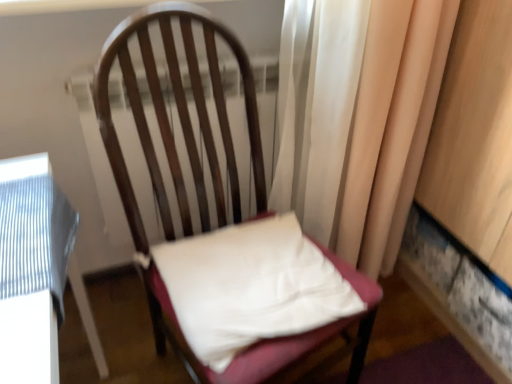
At what (x,y) coordinates should I click in order to perform the action: click on white fabric pillow at center. Please return your answer as a coordinate pair (x, y). Looking at the image, I should click on (250, 286).

Describe the element at coordinates (357, 118) in the screenshot. I see `silky beige curtain at right` at that location.

What is the approximate width of wooden chair at center?

The width of wooden chair at center is 57.24 centimeters.

This screenshot has height=384, width=512. What do you see at coordinates (179, 117) in the screenshot?
I see `wooden chair at center` at bounding box center [179, 117].

Where is `white fabric pillow at center`? This screenshot has width=512, height=384. white fabric pillow at center is located at coordinates (250, 286).

Is white fabric pillow at center taller or shorter than wooden chair at center?

In the image, white fabric pillow at center appears to be shorter than wooden chair at center.

From a real-world perspective, which object rests below the other?

In real-world perspective, white fabric pillow at center is lower.

Is white fabric pillow at center next to wooden chair at center and touching it?

No, white fabric pillow at center is not making contact with wooden chair at center.

Can you confirm if white fabric pillow at center is smaller than wooden chair at center?

Correct, white fabric pillow at center occupies less space than wooden chair at center.

Choose the correct answer: Is wooden chair at center inside silky beige curtain at right or outside it?

wooden chair at center exists outside the volume of silky beige curtain at right.

Is wooden chair at center behind silky beige curtain at right?

No, it is in front of silky beige curtain at right.

Based on the photo, how distant is wooden chair at center from silky beige curtain at right?

wooden chair at center and silky beige curtain at right are 11.75 inches apart.

Can you tell me how much wooden chair at center and silky beige curtain at right differ in facing direction?

The angle between the facing direction of wooden chair at center and the facing direction of silky beige curtain at right is 23.3 degrees.

From the picture: In terms of height, does white fabric pillow at center look taller or shorter compared to silky beige curtain at right?

Clearly, white fabric pillow at center is shorter compared to silky beige curtain at right.

Would you consider white fabric pillow at center to be distant from silky beige curtain at right?

No, white fabric pillow at center is not far from silky beige curtain at right.

Is white fabric pillow at center facing towards silky beige curtain at right?

No.

Considering the positions of objects white fabric pillow at center and silky beige curtain at right in the image provided, who is in front, white fabric pillow at center or silky beige curtain at right?

white fabric pillow at center is more forward.

From their relative heights in the image, would you say silky beige curtain at right is taller or shorter than white fabric pillow at center?

In the image, silky beige curtain at right appears to be taller than white fabric pillow at center.

From the picture: From the image's perspective, which one is positioned lower, silky beige curtain at right or white fabric pillow at center?

white fabric pillow at center is shown below in the image.

Between silky beige curtain at right and white fabric pillow at center, which one has larger width?

white fabric pillow at center is wider.

How many degrees apart are the facing directions of silky beige curtain at right and wooden chair at center?

They differ by 23.3 degrees in their facing directions.

Is silky beige curtain at right positioned before wooden chair at center?

No, it is behind wooden chair at center.

Considering the sizes of objects silky beige curtain at right and wooden chair at center in the image provided, who is taller, silky beige curtain at right or wooden chair at center?

With more height is silky beige curtain at right.

Is wooden chair at center directly adjacent to white fabric pillow at center?

wooden chair at center and white fabric pillow at center are not in contact.

How far apart are wooden chair at center and white fabric pillow at center?

wooden chair at center is 5.61 inches from white fabric pillow at center.

Is white fabric pillow at center inside wooden chair at center?

Yes.

From a real-world perspective, is wooden chair at center on white fabric pillow at center?

Yes, from a real-world perspective, wooden chair at center is on top of white fabric pillow at center.

At what (x,y) coordinates should I click in order to perform the action: click on chair above the white fabric pillow at center (from a real-world perspective). Please return your answer as a coordinate pair (x, y). The width and height of the screenshot is (512, 384). Looking at the image, I should click on (179, 117).

This screenshot has width=512, height=384. In order to click on chair that is below the silky beige curtain at right (from the image's perspective) in this screenshot , I will do `click(179, 117)`.

Consider the image. Considering their positions, is white fabric pillow at center positioned further to silky beige curtain at right than wooden chair at center?

white fabric pillow at center is positioned further to the anchor silky beige curtain at right.

Looking at this image, when comparing their distances from silky beige curtain at right, does wooden chair at center or white fabric pillow at center seem closer?

wooden chair at center is positioned closer to the anchor silky beige curtain at right.

Looking at the image, which one is located closer to wooden chair at center, white fabric pillow at center or silky beige curtain at right?

white fabric pillow at center is positioned closer to the anchor wooden chair at center.

Which object lies further to the anchor point wooden chair at center, silky beige curtain at right or white fabric pillow at center?

silky beige curtain at right.

Considering their positions, is wooden chair at center positioned closer to white fabric pillow at center than silky beige curtain at right?

Based on the image, wooden chair at center appears to be nearer to white fabric pillow at center.

Considering their positions, is silky beige curtain at right positioned closer to white fabric pillow at center than wooden chair at center?

wooden chair at center is positioned closer to the anchor white fabric pillow at center.

In order to click on pillow located between wooden chair at center and silky beige curtain at right in the depth direction in this screenshot , I will do `click(250, 286)`.